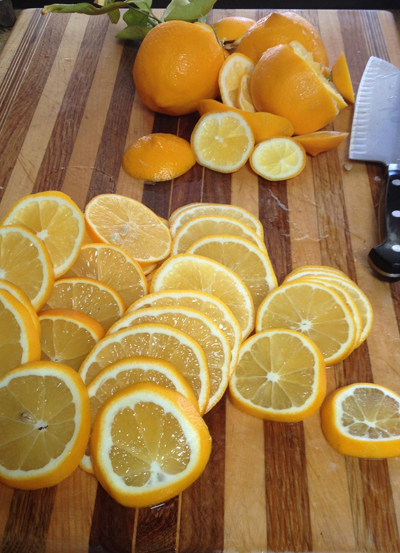
The width and height of the screenshot is (400, 553). What are the coordinates of `knife handle` in the screenshot? It's located at (390, 220).